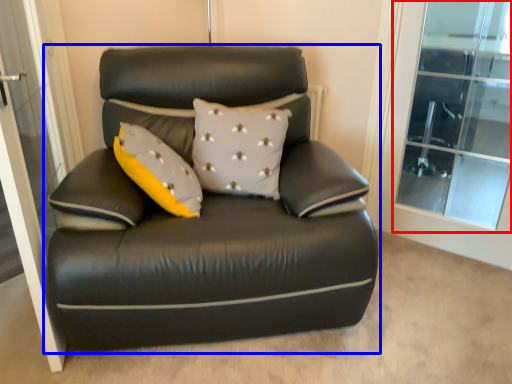
Question: Among these objects, which one is nearest to the camera, window (highlighted by a red box) or studio couch (highlighted by a blue box)?

Choices:
 (A) window
 (B) studio couch

Answer: (B)